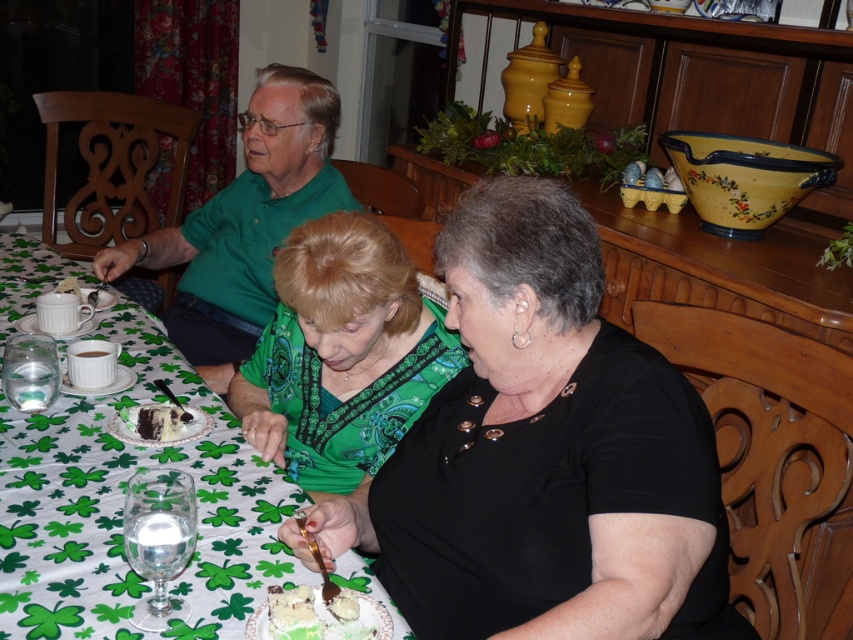
You are standing in the dining area and want to reach the two points marked on the table. Which point, point (210, 384) or point (161, 433), is closer to you?

Point (210, 384) is closer to you because it is further to the viewer than point (161, 433).

You are a guest at this festive dinner and want to place your phone on the green matte shirt at upper left or the chocolate cake at center. Which surface is wider and can accommodate your phone better?

The green matte shirt at upper left is wider than the chocolate cake at center, so placing the phone there would be more stable.